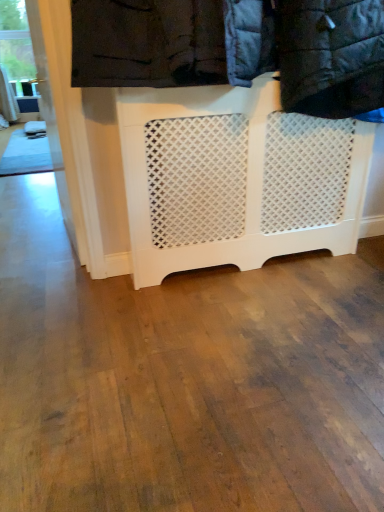
Question: Should I look upward or downward to see clear glass window at upper left?

Choices:
 (A) up
 (B) down

Answer: (A)

Question: Is clear glass window at upper left facing away from white lattice radiator at center?

Choices:
 (A) no
 (B) yes

Answer: (A)

Question: Considering the relative sizes of clear glass window at upper left and white lattice radiator at center in the image provided, is clear glass window at upper left bigger than white lattice radiator at center?

Choices:
 (A) yes
 (B) no

Answer: (B)

Question: Is there a large distance between clear glass window at upper left and white lattice radiator at center?

Choices:
 (A) yes
 (B) no

Answer: (A)

Question: Is clear glass window at upper left positioned before white lattice radiator at center?

Choices:
 (A) yes
 (B) no

Answer: (B)

Question: Does clear glass window at upper left have a lesser width compared to white lattice radiator at center?

Choices:
 (A) yes
 (B) no

Answer: (B)

Question: Is white lattice radiator at center inside clear glass window at upper left?

Choices:
 (A) no
 (B) yes

Answer: (A)

Question: Is white lattice radiator at center wider than clear glass window at upper left?

Choices:
 (A) yes
 (B) no

Answer: (B)

Question: From the image's perspective, does white lattice radiator at center appear higher than clear glass window at upper left?

Choices:
 (A) no
 (B) yes

Answer: (A)

Question: Is white lattice radiator at center surrounding clear glass window at upper left?

Choices:
 (A) no
 (B) yes

Answer: (A)

Question: Does white lattice radiator at center have a lesser height compared to clear glass window at upper left?

Choices:
 (A) no
 (B) yes

Answer: (B)

Question: Could you tell me if white lattice radiator at center is facing clear glass window at upper left?

Choices:
 (A) no
 (B) yes

Answer: (A)

Question: From a real-world perspective, does white lattice radiator at center stand above clear glass window at upper left?

Choices:
 (A) yes
 (B) no

Answer: (B)

Question: Is clear glass window at upper left to the right of white lattice laundry at upper center from the viewer's perspective?

Choices:
 (A) no
 (B) yes

Answer: (A)